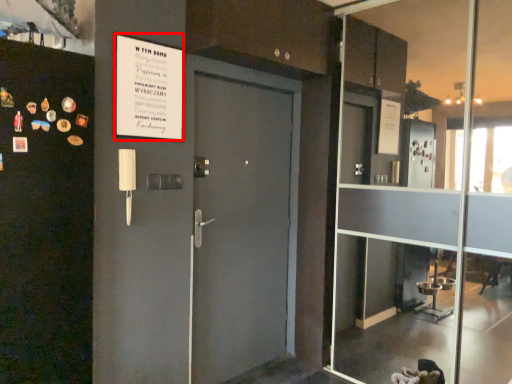
Question: From the image, what is the correct spatial relationship of poster (annotated by the red box) in relation to glass door?

Choices:
 (A) right
 (B) left

Answer: (B)